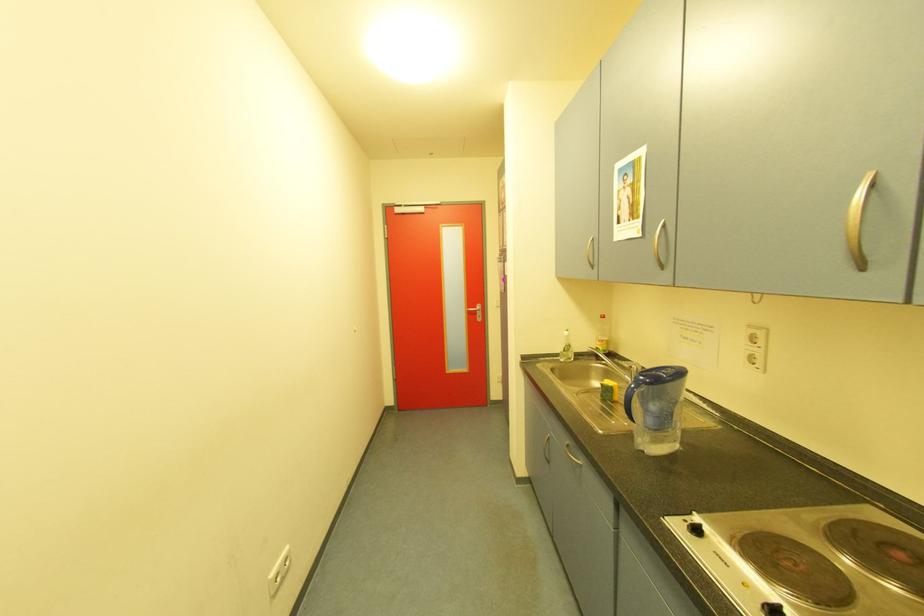
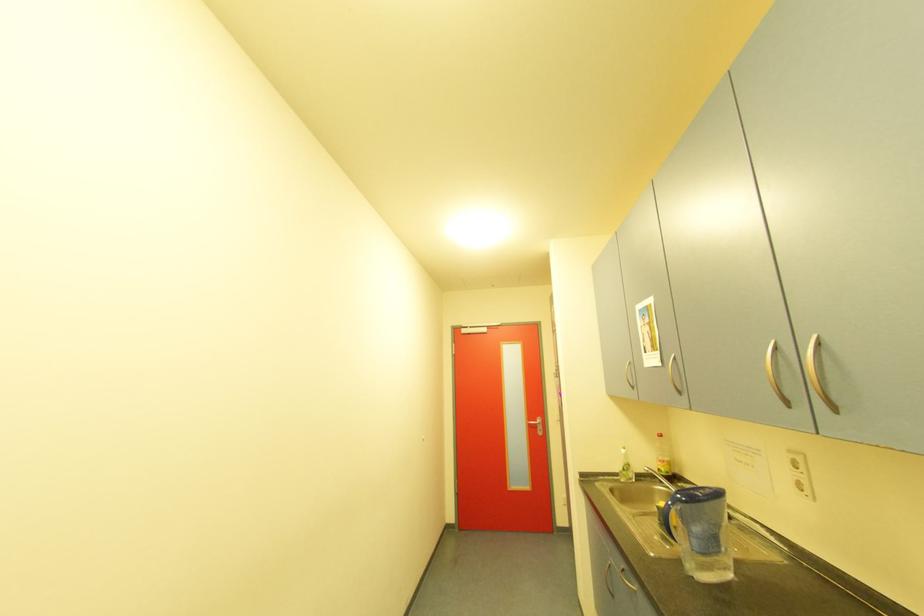
Question: How did the camera likely rotate?

Choices:
 (A) Left
 (B) Right
 (C) Up
 (D) Down

Answer: (C)